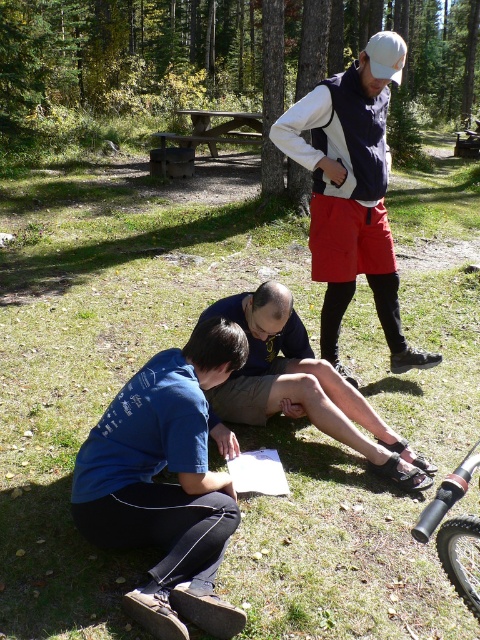
Does blue fabric shirt at lower center have a larger size compared to wooden picnic table at center?

No, blue fabric shirt at lower center is not bigger than wooden picnic table at center.

Does blue fabric shirt at lower center have a smaller size compared to wooden picnic table at center?

Yes.

This screenshot has height=640, width=480. In order to click on blue fabric shirt at lower center in this screenshot , I will do `click(301, 385)`.

Measure the distance from blue fabric shirt at lower center to black matte mountain bike at lower right.

The distance of blue fabric shirt at lower center from black matte mountain bike at lower right is 1.49 meters.

Can you confirm if blue fabric shirt at lower center is positioned above black matte mountain bike at lower right?

Yes, blue fabric shirt at lower center is above black matte mountain bike at lower right.

In order to click on blue fabric shirt at lower center in this screenshot , I will do pos(301,385).

Find the location of a particular element. blue fabric shirt at lower center is located at coordinates (301, 385).

Between point (477, 454) and point (261, 132), which one is positioned behind?

The point (261, 132) is more distant.

Is black matte mountain bike at lower right above wooden picnic table at center?

Incorrect, black matte mountain bike at lower right is not positioned above wooden picnic table at center.

Who is more forward, (x=456, y=582) or (x=250, y=132)?

Positioned in front is point (x=456, y=582).

The height and width of the screenshot is (640, 480). I want to click on black matte mountain bike at lower right, so click(x=462, y=557).